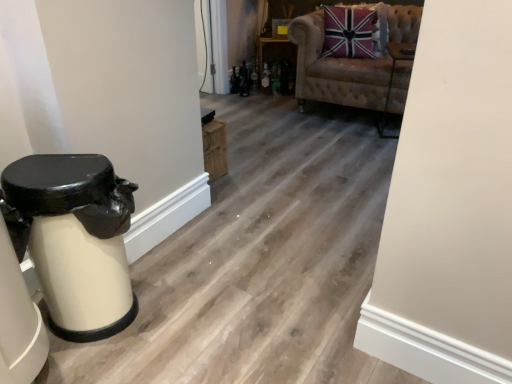
Identify the location of vacant space underneath white glossy trash can at left (from a real-world perspective). (133, 313).